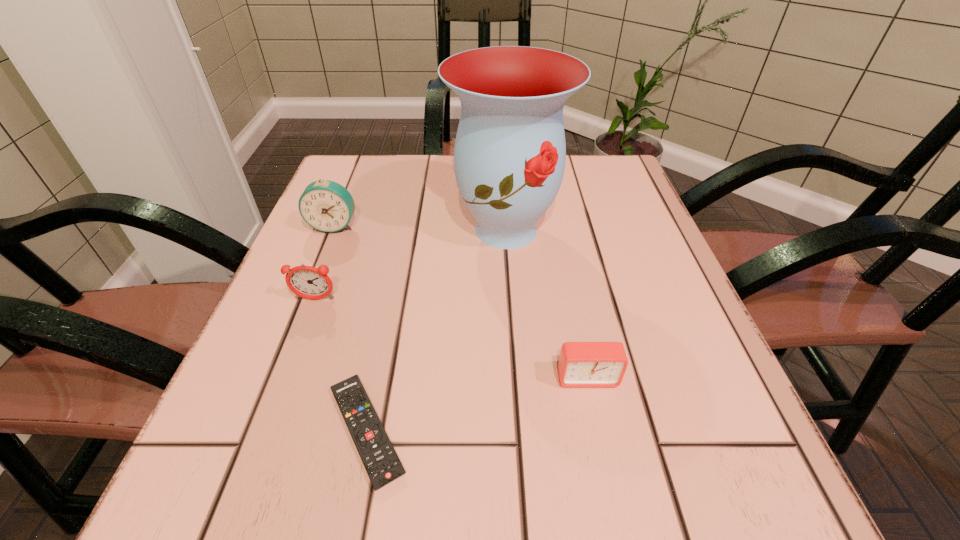
Locate an element on the screen. The width and height of the screenshot is (960, 540). vacant point located between the remote control and the second shortest object is located at coordinates (477, 404).

Where is `empty location between the fourth tallest object and the farthest alarm clock`? The image size is (960, 540). empty location between the fourth tallest object and the farthest alarm clock is located at coordinates (461, 301).

The image size is (960, 540). Find the location of `free space between the fourth shortest object and the fourth tallest object`. free space between the fourth shortest object and the fourth tallest object is located at coordinates (461, 301).

I want to click on unoccupied area between the third tallest object and the vase, so click(411, 265).

Image resolution: width=960 pixels, height=540 pixels. Find the location of `free area in between the third tallest object and the second tallest object`. free area in between the third tallest object and the second tallest object is located at coordinates pos(324,262).

Find the location of a particular element. Image resolution: width=960 pixels, height=540 pixels. empty location between the shortest object and the third nearest object is located at coordinates (341, 365).

Point out which object is positioned as the fourth nearest to the remote control. Please provide its 2D coordinates. Your answer should be formatted as a tuple, i.e. [(x, y)], where the tuple contains the x and y coordinates of a point satisfying the conditions above.

[(325, 205)]

Identify which object is the fourth nearest to the third tallest object. Please provide its 2D coordinates. Your answer should be formatted as a tuple, i.e. [(x, y)], where the tuple contains the x and y coordinates of a point satisfying the conditions above.

[(581, 364)]

Where is `alarm clock identified as the closest to the vase`? The height and width of the screenshot is (540, 960). alarm clock identified as the closest to the vase is located at coordinates (325, 205).

Where is `alarm clock that stands as the second closest to the second shortest object`? alarm clock that stands as the second closest to the second shortest object is located at coordinates (325, 205).